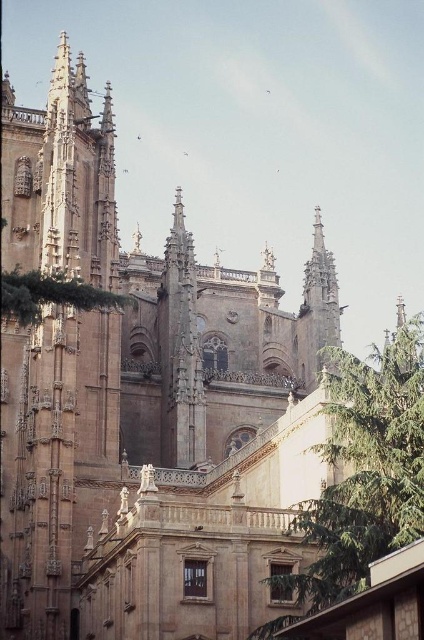
Who is lower down, green leafy tree at center or green leafy tree at upper left?

green leafy tree at center is lower down.

Between green leafy tree at center and green leafy tree at upper left, which one appears on the left side from the viewer's perspective?

From the viewer's perspective, green leafy tree at upper left appears more on the left side.

Find the location of a particular element. The width and height of the screenshot is (424, 640). green leafy tree at center is located at coordinates (365, 468).